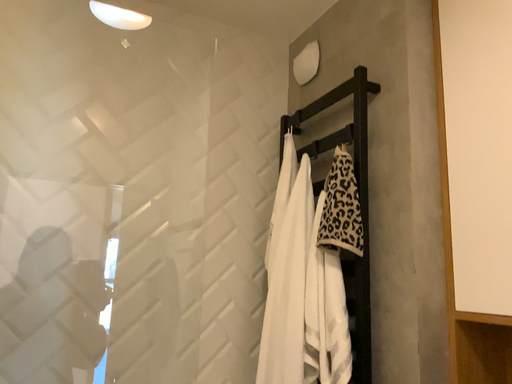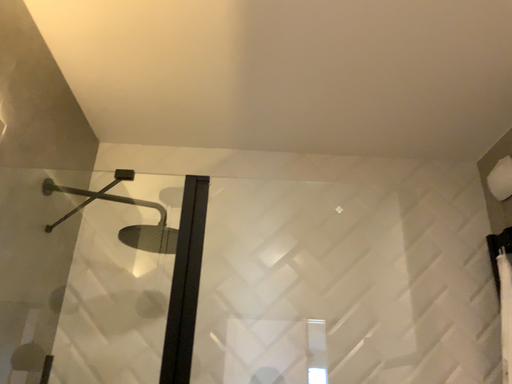
Question: Which way did the camera rotate in the video?

Choices:
 (A) rotated right
 (B) rotated left

Answer: (B)